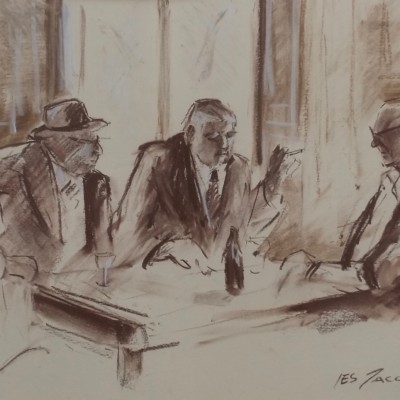
Locate an element on the screen. brown table is located at coordinates (104, 333).